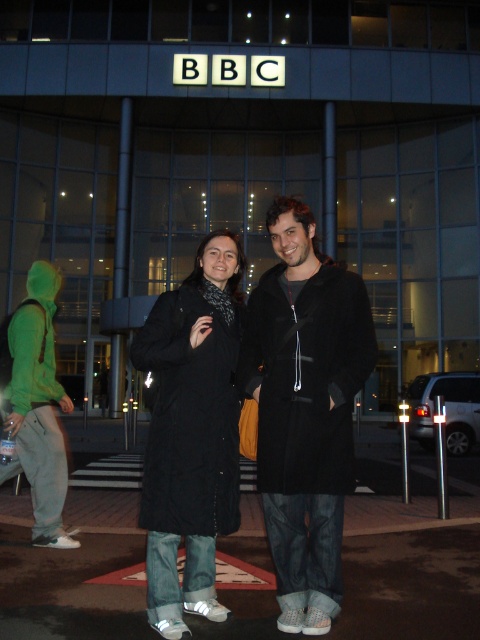
You are a fashion designer observing two coats displayed at a fashion show. The coats are the black wool coat at center and the black matte coat at center. Which coat is taller?

The black wool coat at center is taller than the black matte coat at center.

From the picture: You are a photographer trying to capture a clear shot of the BBC building at night. You notice two items in the foreground that might obstruct your view. Which item is closer to the camera, the black matte coat at center or the green hoodie at left?

The green hoodie at left is closer to the camera because the black matte coat at center is located above it, indicating it is further back.